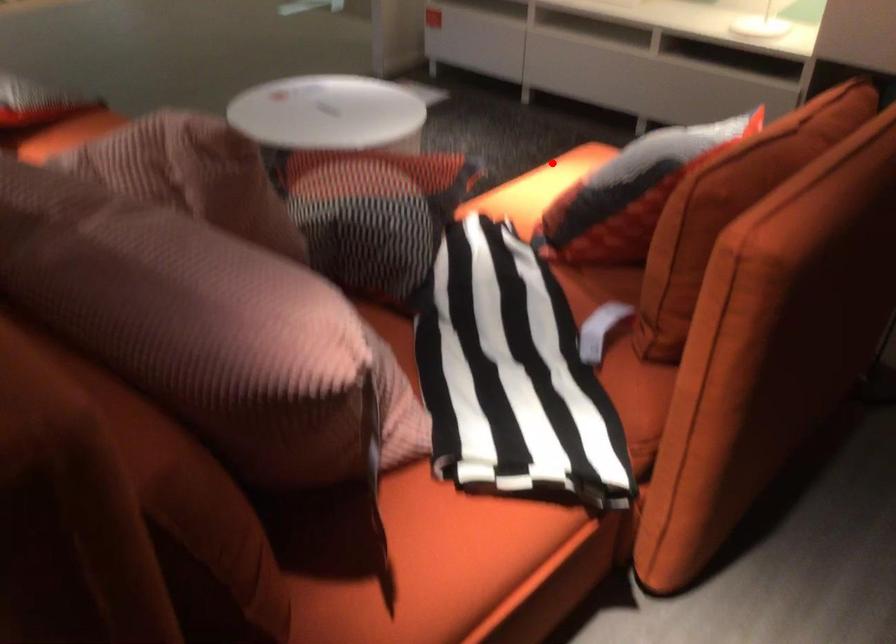
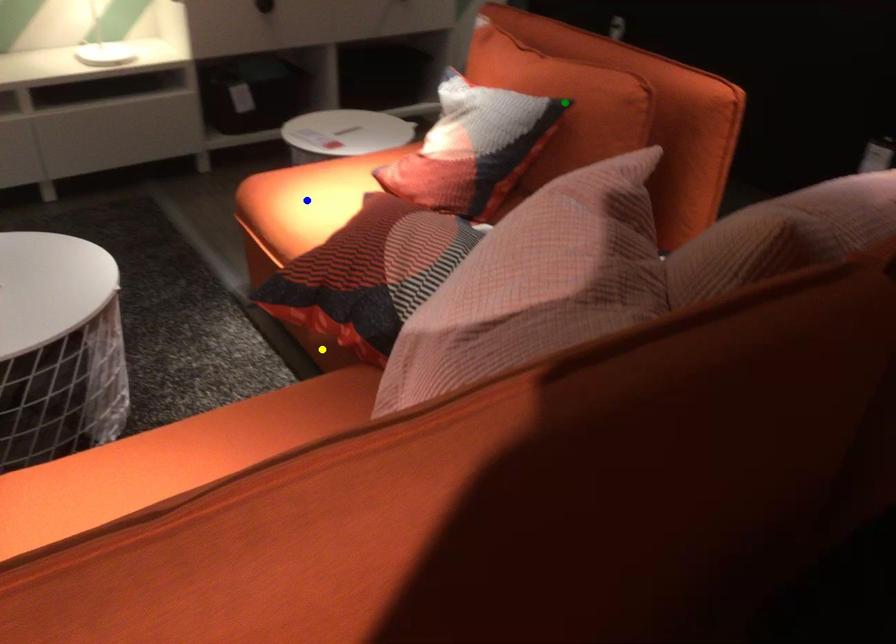
Question: I am providing you with two images of the same scene from different viewpoints. A red point is marked on the first image. You are given multiple points on the second image. In image 2, which mark is for the same physical point as the one in image 1?

Choices:
 (A) blue point
 (B) green point
 (C) yellow point

Answer: (A)